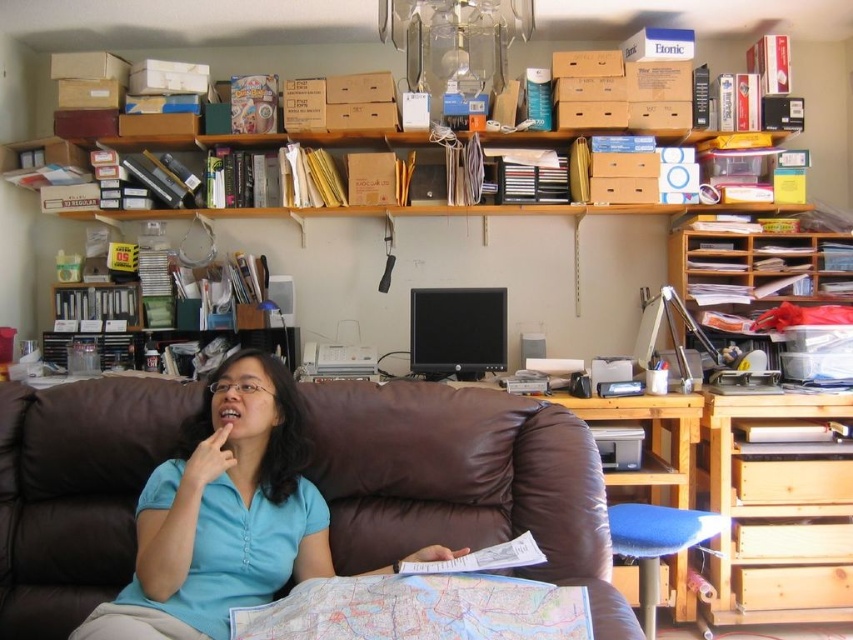
Based on the photo, which is above, blue cotton shirt at center or wooden desk at right?

wooden desk at right is higher up.

Does blue cotton shirt at center have a larger size compared to wooden desk at right?

Indeed, blue cotton shirt at center has a larger size compared to wooden desk at right.

Is point (235, 456) behind point (712, 243)?

No, (235, 456) is closer to viewer.

This screenshot has height=640, width=853. I want to click on blue cotton shirt at center, so click(223, 515).